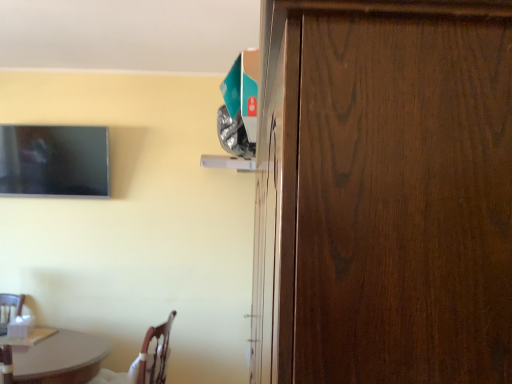
Question: Could you tell me if dark wood door at right is facing wooden chair at lower left?

Choices:
 (A) yes
 (B) no

Answer: (A)

Question: Is dark wood door at right located outside wooden chair at lower left?

Choices:
 (A) yes
 (B) no

Answer: (A)

Question: From the image's perspective, would you say dark wood door at right is positioned over wooden chair at lower left?

Choices:
 (A) yes
 (B) no

Answer: (A)

Question: Is dark wood door at right turned away from wooden chair at lower left?

Choices:
 (A) yes
 (B) no

Answer: (B)

Question: From the image's perspective, is dark wood door at right located beneath wooden chair at lower left?

Choices:
 (A) no
 (B) yes

Answer: (A)

Question: Does dark wood door at right come in front of wooden chair at lower left?

Choices:
 (A) yes
 (B) no

Answer: (A)

Question: Would you say dark wood door at right contains matte black tv at upper left?

Choices:
 (A) no
 (B) yes

Answer: (A)

Question: Can you confirm if dark wood door at right is thinner than matte black tv at upper left?

Choices:
 (A) yes
 (B) no

Answer: (B)

Question: From the image's perspective, is dark wood door at right under matte black tv at upper left?

Choices:
 (A) no
 (B) yes

Answer: (B)

Question: Considering the relative positions of dark wood door at right and matte black tv at upper left in the image provided, is dark wood door at right to the right of matte black tv at upper left from the viewer's perspective?

Choices:
 (A) yes
 (B) no

Answer: (A)

Question: Can you confirm if dark wood door at right is positioned to the left of matte black tv at upper left?

Choices:
 (A) no
 (B) yes

Answer: (A)

Question: Is dark wood door at right taller than matte black tv at upper left?

Choices:
 (A) no
 (B) yes

Answer: (B)

Question: From the image's perspective, is matte black tv at upper left below dark wood door at right?

Choices:
 (A) yes
 (B) no

Answer: (B)